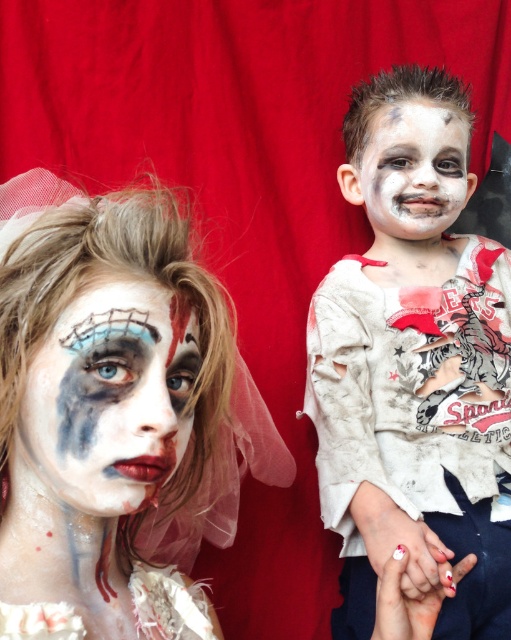
From the picture: Is matte white face paint at center further to camera compared to matte painted face at center?

That is False.

The image size is (511, 640). What are the coordinates of `matte white face paint at center` in the screenshot? It's located at (117, 420).

Between matte white face paint at center and white matte shirt at right, which one appears on the left side from the viewer's perspective?

matte white face paint at center is more to the left.

Can you confirm if matte white face paint at center is positioned above white matte shirt at right?

Incorrect, matte white face paint at center is not positioned above white matte shirt at right.

You are a GUI agent. You are given a task and a screenshot of the screen. Output one action in this format:
    pyautogui.click(x=<x>, y=<y>)
    Task: Click on the matte white face paint at center
    This screenshot has width=511, height=640.
    Given the screenshot: What is the action you would take?
    pyautogui.click(x=117, y=420)

At what (x,y) coordinates should I click in order to perform the action: click on matte white face paint at center. Please return your answer as a coordinate pair (x, y). This screenshot has width=511, height=640. Looking at the image, I should click on (117, 420).

Measure the distance between white matte shirt at right and white matte face paint at upper right.

white matte shirt at right is 5.53 inches from white matte face paint at upper right.

Does point (341, 461) come behind point (432, 156)?

No, (341, 461) is closer to viewer.

Image resolution: width=511 pixels, height=640 pixels. Find the location of `white matte shirt at right`. white matte shirt at right is located at coordinates (414, 364).